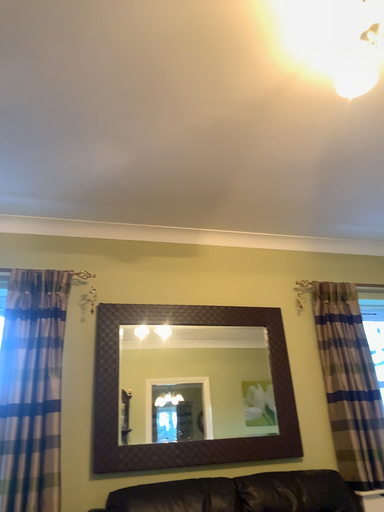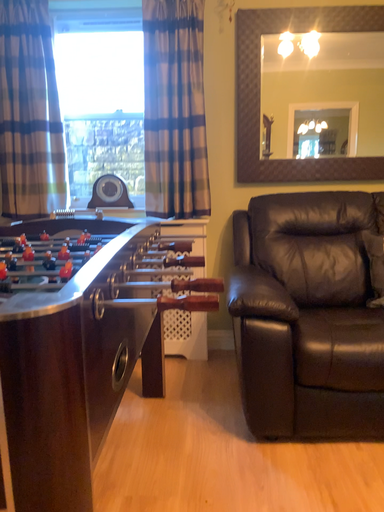
Question: Which way did the camera rotate in the video?

Choices:
 (A) rotated left
 (B) rotated right

Answer: (A)